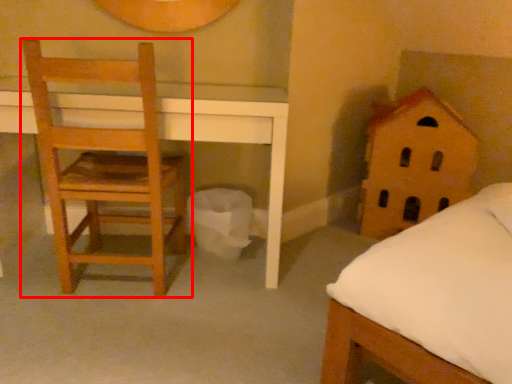
Question: Where is chair (annotated by the red box) located in relation to toy in the image?

Choices:
 (A) right
 (B) left

Answer: (B)